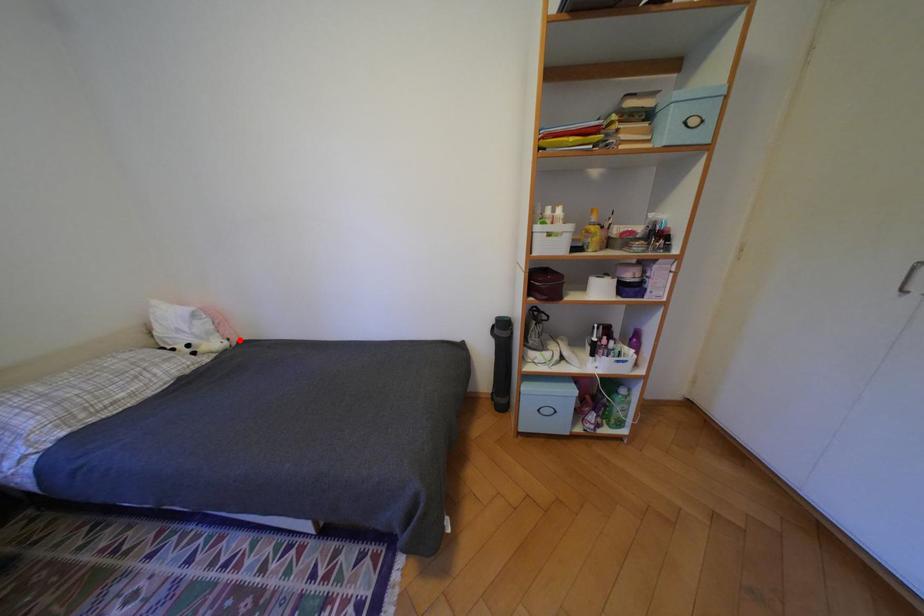
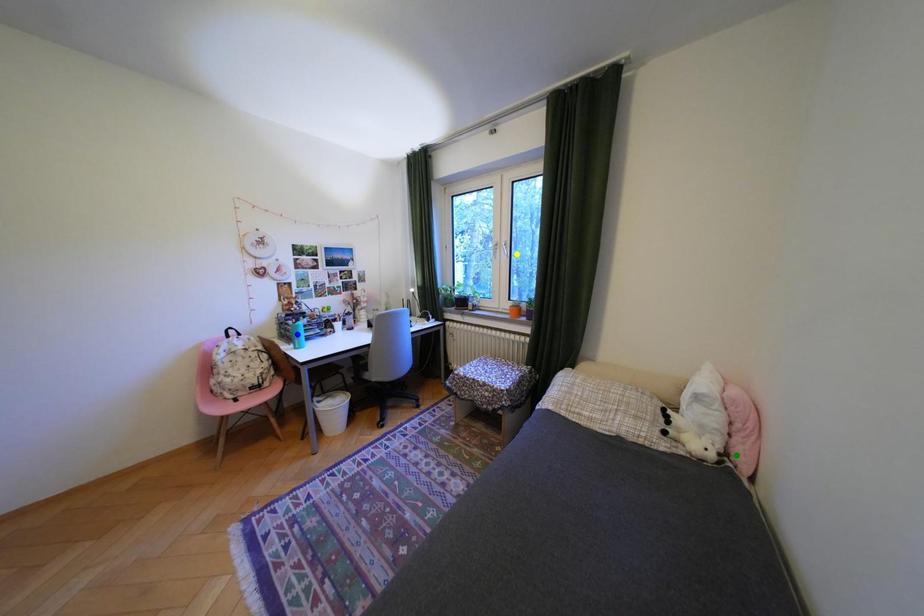
Question: I am providing you with two images of the same scene from different viewpoints. A red point is marked on the first image. You are given multiple points on the second image. Which mark in image 2 goes with the point in image 1?

Choices:
 (A) green point
 (B) blue point
 (C) yellow point

Answer: (A)